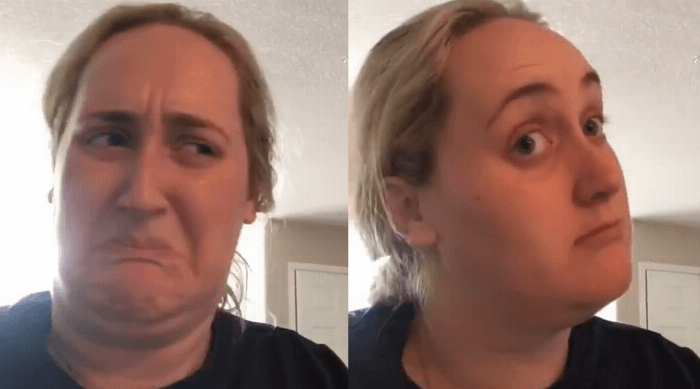
Find the location of a particular element. This screenshot has width=700, height=389. popcorn ceiling right pic is located at coordinates (309, 48).